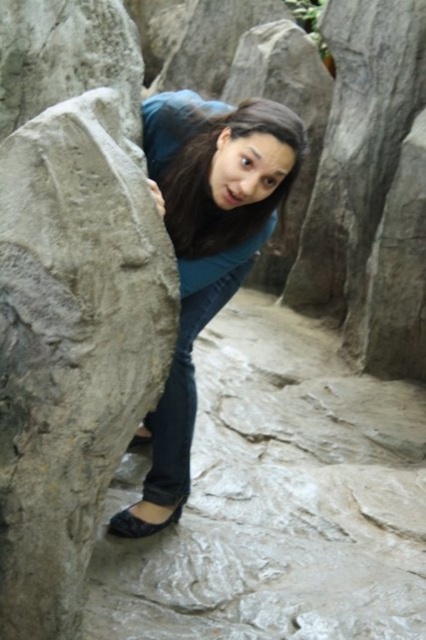
Question: Can you confirm if brown matte hair at center is bigger than black leather sandal at lower left?

Choices:
 (A) no
 (B) yes

Answer: (B)

Question: Is brown matte hair at center to the right of black leather sandal at lower left from the viewer's perspective?

Choices:
 (A) no
 (B) yes

Answer: (B)

Question: Which point is closer to the camera taking this photo?

Choices:
 (A) (152, 492)
 (B) (267, 211)
 (C) (129, 525)

Answer: (B)

Question: Which object appears closest to the camera in this image?

Choices:
 (A) blue matte shirt at center
 (B) brown matte hair at center
 (C) black leather sandal at lower left

Answer: (B)

Question: In this image, where is blue matte shirt at center located relative to brown matte hair at center?

Choices:
 (A) right
 (B) left

Answer: (B)

Question: Considering the real-world distances, which object is closest to the brown matte hair at center?

Choices:
 (A) blue matte shirt at center
 (B) black leather sandal at lower left

Answer: (A)